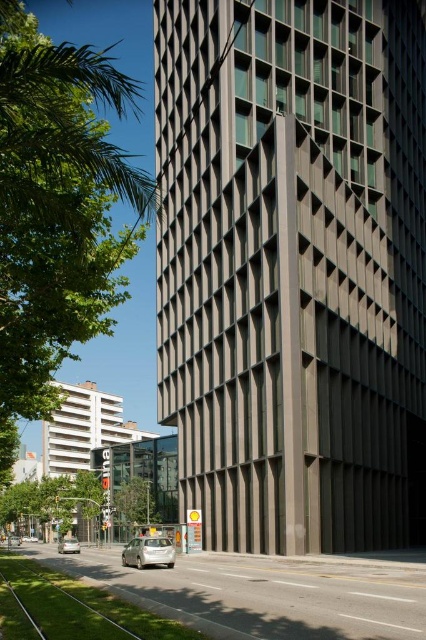
Where is `green leafy tree at left`? Image resolution: width=426 pixels, height=640 pixels. green leafy tree at left is located at coordinates (55, 211).

Which is more to the left, green leafy tree at left or silver metallic car at lower left?

Positioned to the left is green leafy tree at left.

Does point (57, 164) lie in front of point (63, 550)?

Yes, point (57, 164) is closer to viewer.

Locate an element on the screen. green leafy tree at left is located at coordinates (55, 211).

Can you confirm if green leafy tree at left is positioned to the left of silver metallic car at lower center?

Correct, you'll find green leafy tree at left to the left of silver metallic car at lower center.

Who is shorter, green leafy tree at left or silver metallic car at lower center?

With less height is silver metallic car at lower center.

Image resolution: width=426 pixels, height=640 pixels. Describe the element at coordinates (55, 211) in the screenshot. I see `green leafy tree at left` at that location.

The image size is (426, 640). In order to click on green leafy tree at left in this screenshot , I will do `click(55, 211)`.

Identify the location of green leafy tree at left. The width and height of the screenshot is (426, 640). point(55,211).

Consider the image. Who is lower down, green leafy tree at left or green leafy tree at lower center?

green leafy tree at lower center

Locate an element on the screen. The image size is (426, 640). green leafy tree at left is located at coordinates (55, 211).

The width and height of the screenshot is (426, 640). I want to click on green leafy tree at left, so click(x=55, y=211).